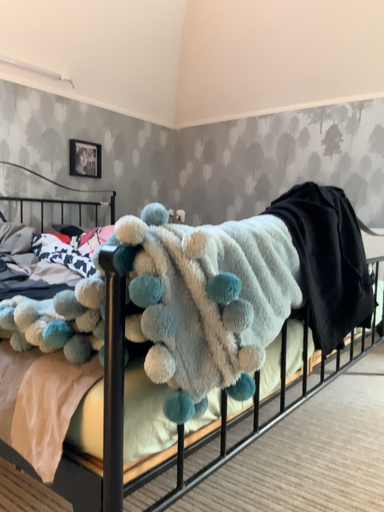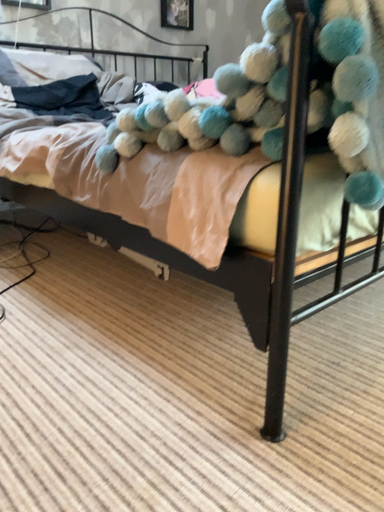
Question: How did the camera likely rotate when shooting the video?

Choices:
 (A) rotated downward
 (B) rotated upward

Answer: (A)